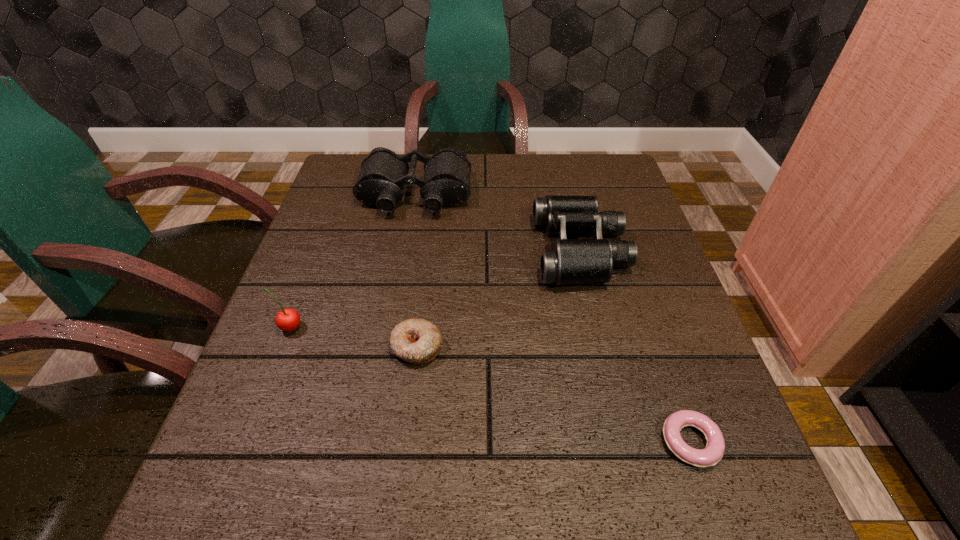
You are a GUI agent. You are given a task and a screenshot of the screen. Output one action in this format:
    pyautogui.click(x=<x>, y=<y>)
    Task: Click on the right binoculars
    This screenshot has height=540, width=960.
    Given the screenshot: What is the action you would take?
    pyautogui.click(x=570, y=261)

Image resolution: width=960 pixels, height=540 pixels. In order to click on the left binoculars in this screenshot , I will do `click(446, 182)`.

This screenshot has width=960, height=540. I want to click on cherry, so click(288, 319).

The width and height of the screenshot is (960, 540). Identify the location of the farther doughnut. (417, 341).

At what (x,y) coordinates should I click in order to perform the action: click on the left doughnut. Please return your answer as a coordinate pair (x, y). Image resolution: width=960 pixels, height=540 pixels. Looking at the image, I should click on (417, 341).

Identify the location of the shortest object. Image resolution: width=960 pixels, height=540 pixels. (713, 452).

Where is `the right doughnut`? the right doughnut is located at coordinates (713, 452).

The height and width of the screenshot is (540, 960). What are the coordinates of `free space located 0.080m on the front-facing side of the right binoculars` in the screenshot? It's located at (501, 250).

I want to click on vacant space situated on the front-facing side of the right binoculars, so click(423, 250).

Locate an element on the screen. free point located 0.350m on the front-facing side of the right binoculars is located at coordinates (384, 250).